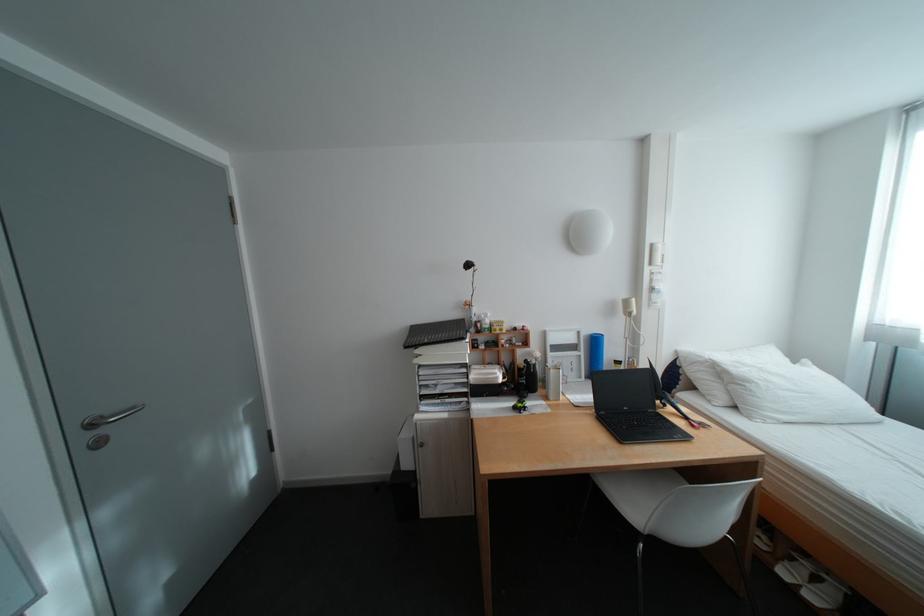
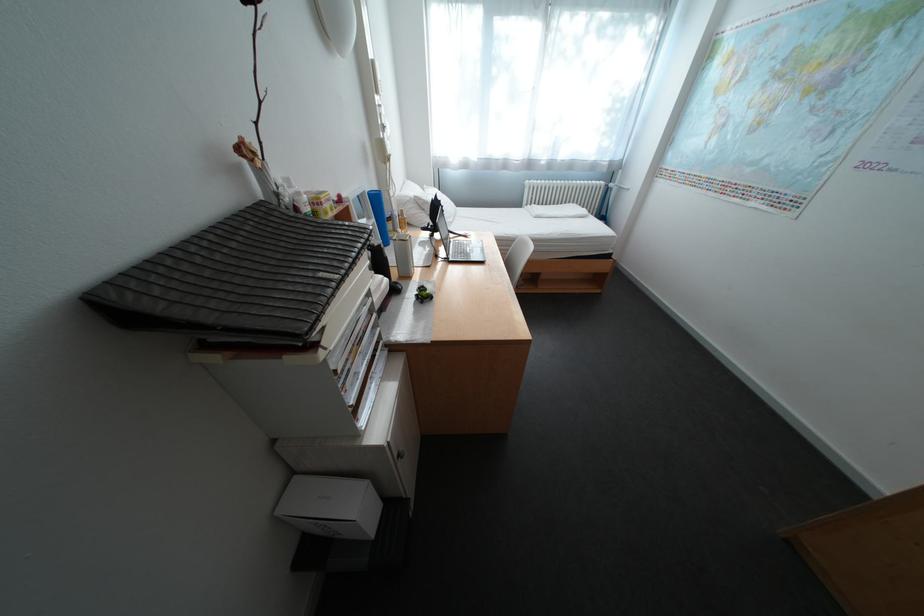
In the second image, find the point that corresponds to the point at 501,379 in the first image.

(395, 292)